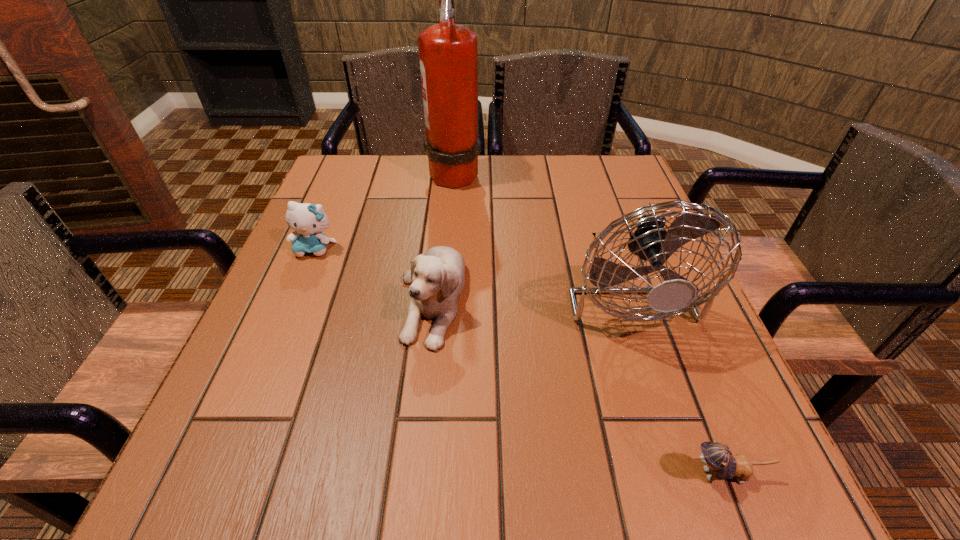
Where is `free space located on the front-facing side of the puppy`? The image size is (960, 540). free space located on the front-facing side of the puppy is located at coordinates (416, 455).

At what (x,y) coordinates should I click in order to perform the action: click on vacant point located on the face of the left kitten. Please return your answer as a coordinate pair (x, y). Image resolution: width=960 pixels, height=540 pixels. Looking at the image, I should click on (300, 287).

Identify the location of vacant point located 0.190m on the front-facing side of the shorter kitten. (549, 474).

This screenshot has width=960, height=540. Find the location of `free space located 0.110m on the front-facing side of the shorter kitten`. free space located 0.110m on the front-facing side of the shorter kitten is located at coordinates (606, 474).

At what (x,y) coordinates should I click in order to perform the action: click on free region located on the front-facing side of the shorter kitten. Please return your answer as a coordinate pair (x, y). The height and width of the screenshot is (540, 960). Looking at the image, I should click on (448, 474).

This screenshot has height=540, width=960. I want to click on object located in the far edge section of the desktop, so click(448, 53).

This screenshot has width=960, height=540. I want to click on object present at the near edge, so pos(718,459).

Where is `object present at the left edge`? object present at the left edge is located at coordinates (308, 221).

I want to click on fan at the right edge, so click(650, 241).

Locate an element on the screen. kitten that is at the right edge is located at coordinates (718, 459).